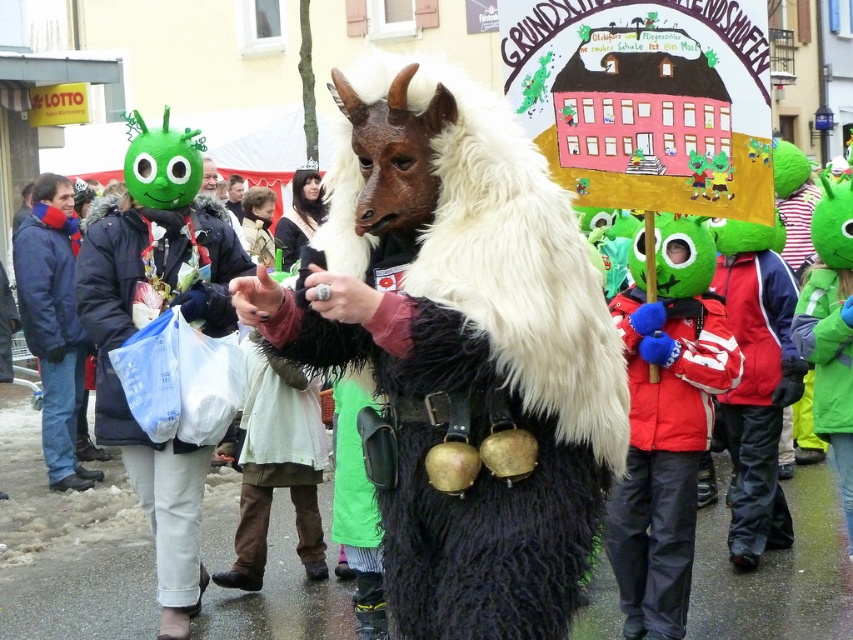
You are standing at the center of the scene. You need to reach the smooth brown leather jacket at center before the furry black and white goat at center can stop you. Which direction should you move to get to the jacket first?

The furry black and white goat at center is 33.77 feet away from smooth brown leather jacket at center. To reach the jacket first, you should move towards the jacket directly since the goat is farther away and would take longer to reach it.